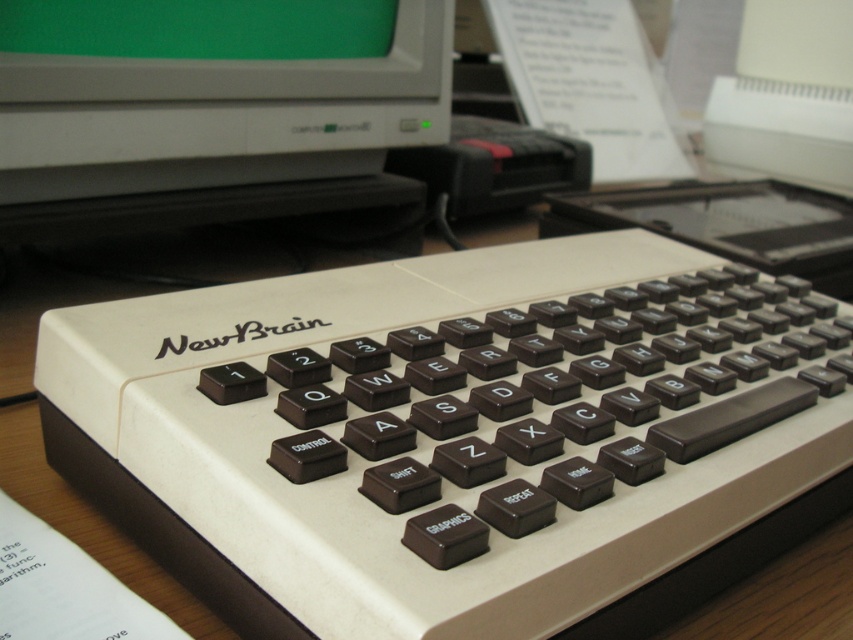
You are setting up a new desk and want to place both the green matte monitor at upper center and the white plastic keyboard at center. According to the image, which object should be placed higher to match the original setup?

The green matte monitor at upper center should be placed higher than the white plastic keyboard at center because it is positioned above it in the original setup.

You are a technician who needs to check the green matte monitor at upper center. Your tool kit is 60 centimeters long. Can you reach the monitor from your current position without moving?

The green matte monitor at upper center and the viewer are 55.93 centimeters apart. Since the tool kit is 60 centimeters long, you can extend it to reach the monitor.

You are trying to adjust the position of the keyboard labeled NewBrain so that it is exactly 70 centimeters away from the camera. Currently, the point at coordinates point (270, 116) is 72.44 centimeters away. How should you move the keyboard labeled NewBrain?

To adjust the keyboard labeled NewBrain to be exactly 70 centimeters away from the camera, you need to move it closer by approximately 2.44 centimeters since the current distance at point (270, 116) is 72.44 centimeters.